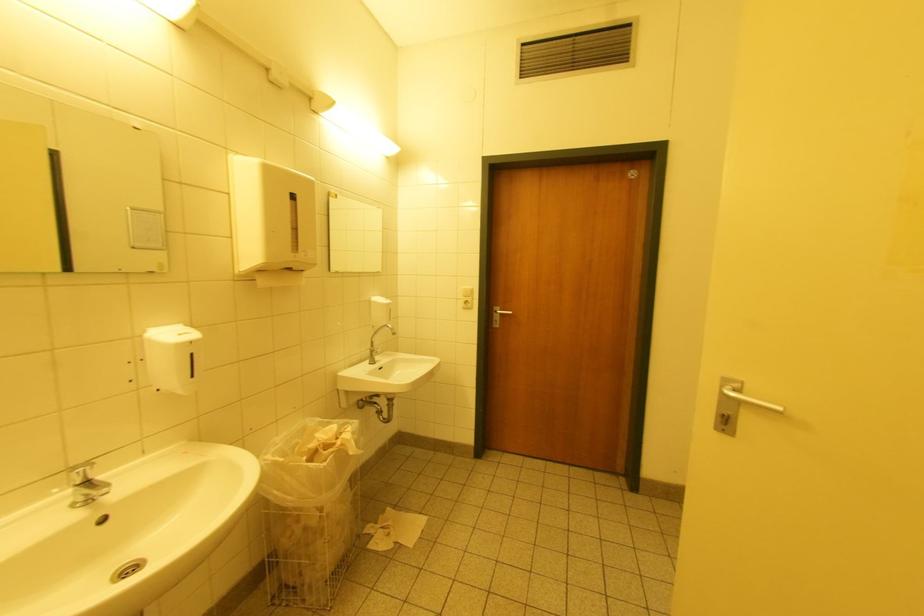
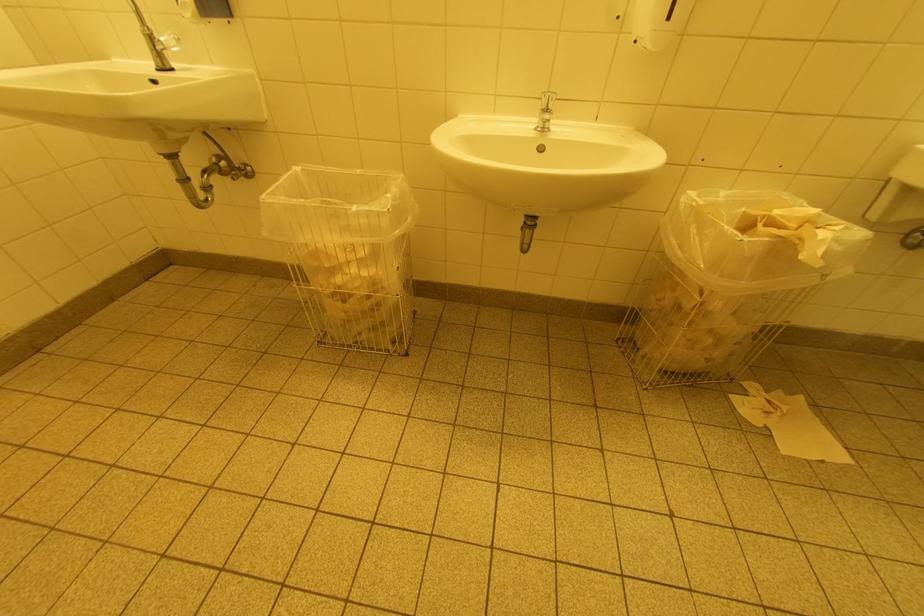
First-person continuous shooting, in which direction is the camera rotating?

The camera's rotation is toward left-down.